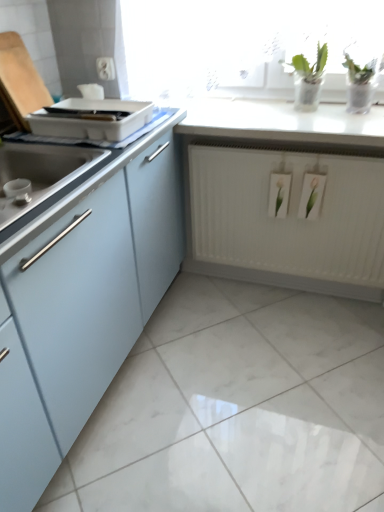
Locate an element on the screen. The image size is (384, 512). free space on the front side of white matte radiator at center is located at coordinates (288, 358).